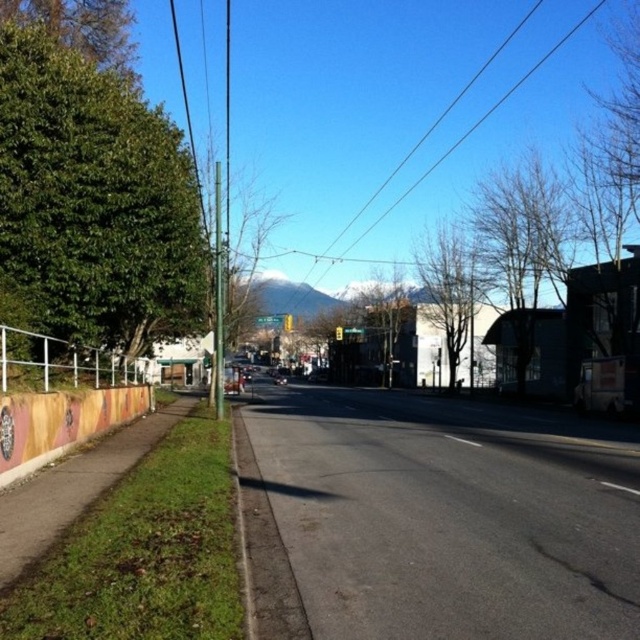
Question: Can you confirm if white metal fence at lower left is wider than black wire at upper center?

Choices:
 (A) no
 (B) yes

Answer: (A)

Question: Which point is closer to the camera?

Choices:
 (A) white metal fence at lower left
 (B) black wire at upper center

Answer: (A)

Question: Is white metal fence at lower left positioned in front of black wire at upper center?

Choices:
 (A) no
 (B) yes

Answer: (B)

Question: Considering the relative positions of white metal fence at lower left and black wire at upper center in the image provided, where is white metal fence at lower left located with respect to black wire at upper center?

Choices:
 (A) right
 (B) left

Answer: (B)